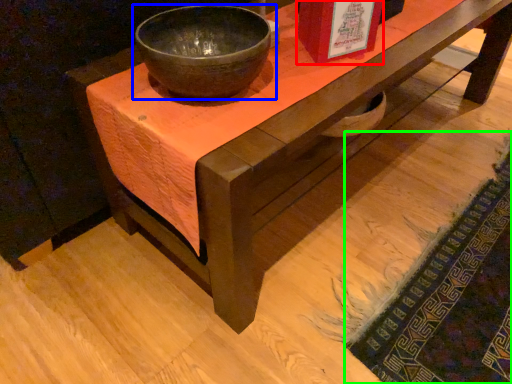
Question: Considering the real-world distances, which object is farthest from book cover (highlighted by a red box)? bowl (highlighted by a blue box) or mat (highlighted by a green box)?

Choices:
 (A) bowl
 (B) mat

Answer: (B)